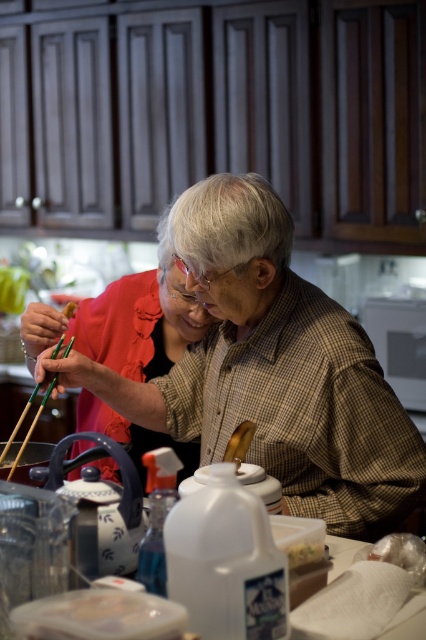
You are a chef preparing to serve a dish. You need to place the matte black shirt at center and the green bamboo chopsticks at left on a table. Considering their positions, can you determine if they can be placed side by side without overlapping?

The matte black shirt at center is 26.65 centimeters away from the green bamboo chopsticks at left. Since the distance between them is sufficient, they can be placed side by side without overlapping.

You are trying to decide whether to place a decorative item between the matte black shirt at center and the green bamboo chopsticks at left. Based on their widths, can you determine if there will be enough space for the item if it requires 10 cm of space?

The matte black shirt at center might be wider than green bamboo chopsticks at left, so there may be sufficient space for the decorative item requiring 10 cm. However, since the exact width difference isn